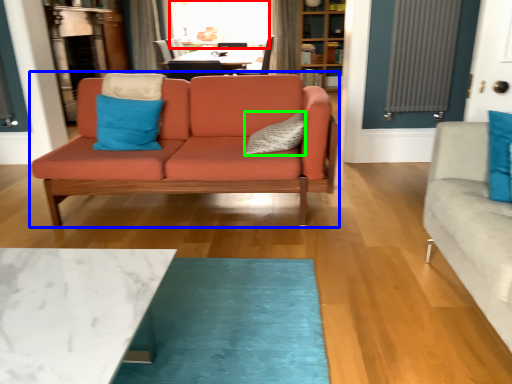
Question: Based on their relative distances, which object is farther from window screen (highlighted by a red box)? Choose from studio couch (highlighted by a blue box) and pillow (highlighted by a green box).

Choices:
 (A) studio couch
 (B) pillow

Answer: (B)